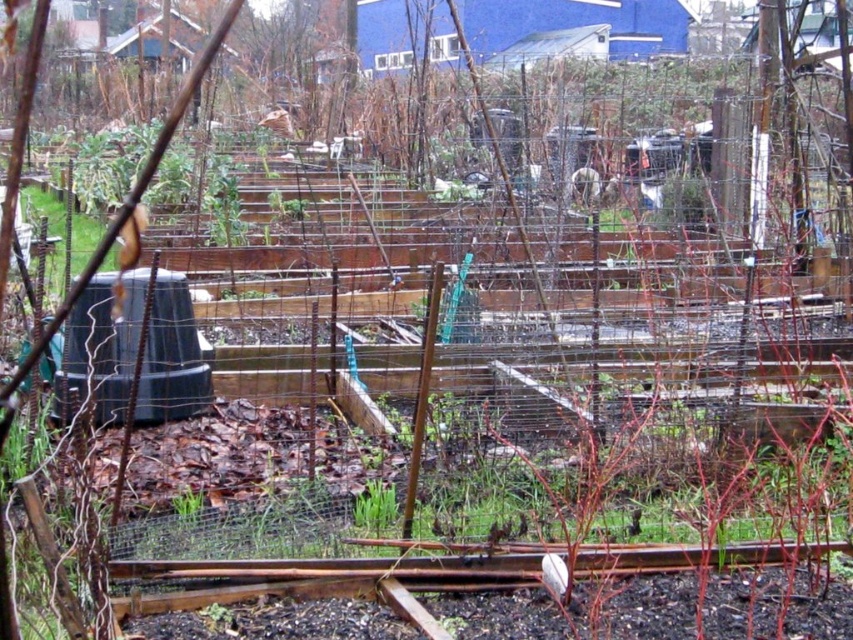
Question: Is green leafy plant at center thinner than green grass at center?

Choices:
 (A) no
 (B) yes

Answer: (B)

Question: In this image, where is green leafy plant at center located relative to green grass at center?

Choices:
 (A) above
 (B) below

Answer: (A)

Question: Which object appears farthest from the camera in this image?

Choices:
 (A) green grass at center
 (B) green leafy plant at center

Answer: (B)

Question: Is green leafy plant at center positioned behind green grass at center?

Choices:
 (A) no
 (B) yes

Answer: (B)